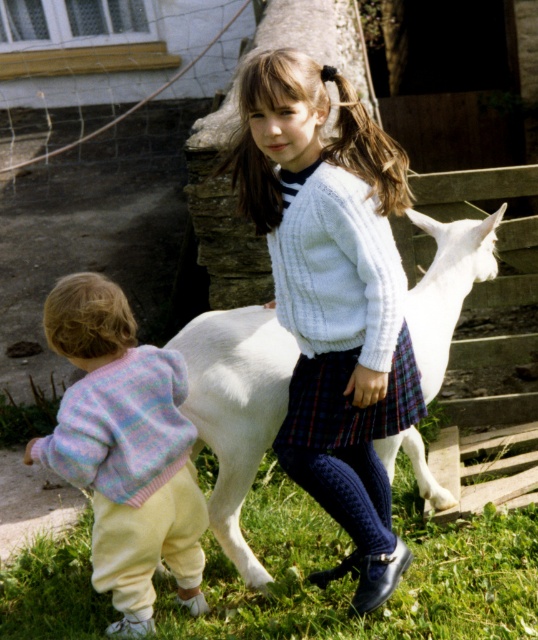
Question: Is white knitted sweater at center in front of pastel knitted sweater at lower left?

Choices:
 (A) no
 (B) yes

Answer: (B)

Question: Which object appears farthest from the camera in this image?

Choices:
 (A) pastel knitted sweater at lower left
 (B) green grass at lower center

Answer: (B)

Question: Observing the image, what is the correct spatial positioning of white knitted sweater at center in reference to pastel knitted sweater at lower left?

Choices:
 (A) above
 (B) below

Answer: (A)

Question: Based on their relative distances, which object is nearer to the plaid fabric miniskirt at center?

Choices:
 (A) green grass at lower center
 (B) pastel knitted sweater at lower left
 (C) white woolen goat at center

Answer: (C)

Question: Which point is closer to the camera?

Choices:
 (A) (75, 300)
 (B) (450, 252)
 (C) (377, 522)

Answer: (A)

Question: Is green grass at lower center below plaid fabric miniskirt at center?

Choices:
 (A) yes
 (B) no

Answer: (A)